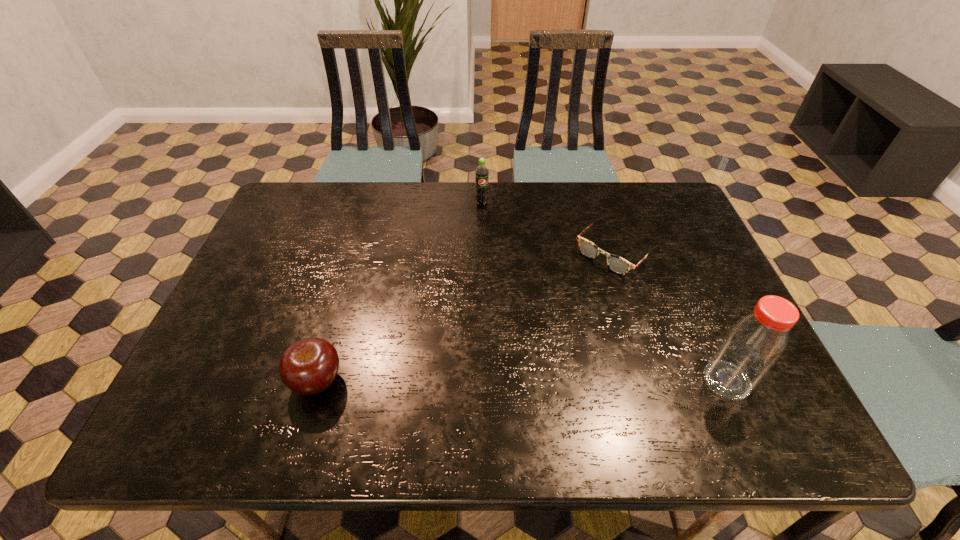
You are a GUI agent. You are given a task and a screenshot of the screen. Output one action in this format:
    pyautogui.click(x=<x>, y=<y>)
    Task: Click on the free space on the desktop that is between the leftmost object and the bottle and is positioned on the frame of the shortest object
    This screenshot has height=540, width=960.
    Given the screenshot: What is the action you would take?
    (481, 381)

Where is `vacant spot on the desktop that is between the leftmost object and the tallest object and is positioned on the front label of the farthest object`? The height and width of the screenshot is (540, 960). vacant spot on the desktop that is between the leftmost object and the tallest object and is positioned on the front label of the farthest object is located at coordinates (501, 381).